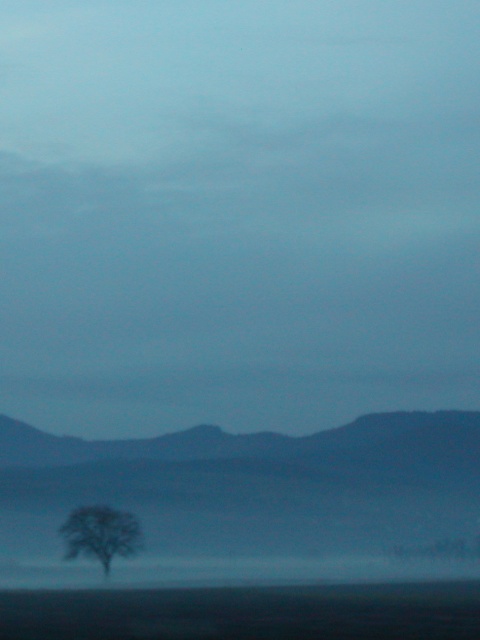
Question: Which object is farther from the camera taking this photo?

Choices:
 (A) silvery gray tree at lower left
 (B) dark gray textured mountain at lower left

Answer: (B)

Question: Which point is closer to the camera taking this photo?

Choices:
 (A) (343, 548)
 (B) (90, 552)

Answer: (B)

Question: Can you confirm if dark gray textured mountain at lower left is bigger than silvery gray tree at lower left?

Choices:
 (A) no
 (B) yes

Answer: (B)

Question: Can you confirm if dark gray textured mountain at lower left is positioned below silvery gray tree at lower left?

Choices:
 (A) no
 (B) yes

Answer: (A)

Question: Can you confirm if dark gray textured mountain at lower left is bigger than silvery gray tree at lower left?

Choices:
 (A) yes
 (B) no

Answer: (A)

Question: Which point is closer to the camera?

Choices:
 (A) silvery gray tree at lower left
 (B) dark gray textured mountain at lower left

Answer: (A)